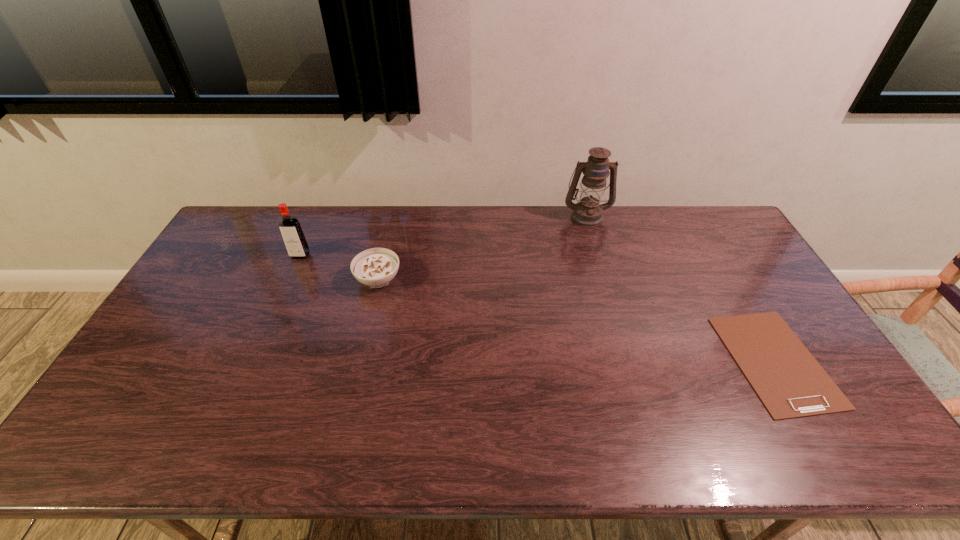
This screenshot has width=960, height=540. Find the location of `free region located 0.210m on the right of the third object from right to left`. free region located 0.210m on the right of the third object from right to left is located at coordinates (467, 279).

Locate an element on the screen. Image resolution: width=960 pixels, height=540 pixels. vacant area situated on the back of the nearest object is located at coordinates (705, 239).

Identify the location of object that is at the far edge. This screenshot has height=540, width=960. (588, 212).

This screenshot has width=960, height=540. What are the coordinates of `object present at the right edge` in the screenshot? It's located at (788, 380).

This screenshot has height=540, width=960. Identify the location of vacant area at the far edge of the desktop. (671, 245).

In the image, there is a desktop. Identify the location of vacant area at the near edge. The width and height of the screenshot is (960, 540). (463, 456).

The image size is (960, 540). I want to click on free location at the far left corner of the desktop, so click(x=266, y=218).

Image resolution: width=960 pixels, height=540 pixels. Find the location of `vacant space at the far right corner of the desktop`. vacant space at the far right corner of the desktop is located at coordinates (729, 222).

Identify the location of unoccupied position between the farthest object and the third nearest object. The width and height of the screenshot is (960, 540). click(x=444, y=236).

Find the location of `empty space that is in between the farthest object and the clipboard`. empty space that is in between the farthest object and the clipboard is located at coordinates (681, 288).